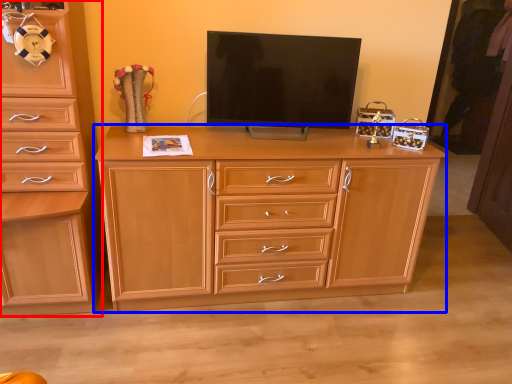
Question: Which point is further to the camera, chest of drawers (highlighted by a red box) or chest of drawers (highlighted by a blue box)?

Choices:
 (A) chest of drawers
 (B) chest of drawers

Answer: (B)